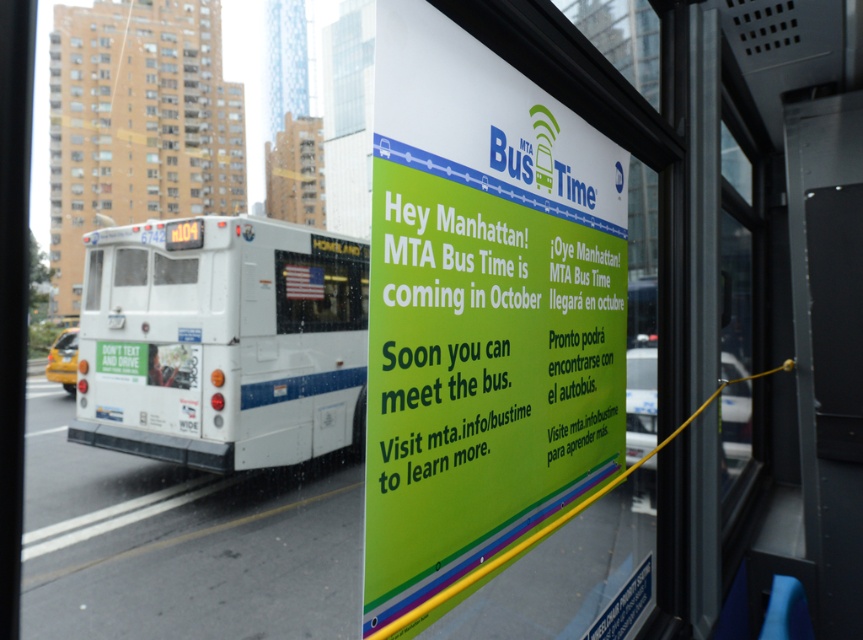
Question: Which point is farther to the camera?

Choices:
 (A) reflective glass american flag at center
 (B) white glossy bus at left
 (C) green paper sign at center

Answer: (A)

Question: Which of the following is the farthest from the observer?

Choices:
 (A) green matte poster at center
 (B) white matte bus at upper left
 (C) white glossy bus at left

Answer: (B)

Question: Is green paper sign at center below white matte bus at upper left?

Choices:
 (A) yes
 (B) no

Answer: (A)

Question: Is green paper sign at center to the right of white matte bus at upper left from the viewer's perspective?

Choices:
 (A) no
 (B) yes

Answer: (B)

Question: Which object is closer to the camera taking this photo?

Choices:
 (A) reflective glass american flag at center
 (B) white matte bus at upper left
 (C) green paper sign at center

Answer: (C)

Question: Does green paper sign at center have a lesser width compared to green matte poster at center?

Choices:
 (A) yes
 (B) no

Answer: (B)